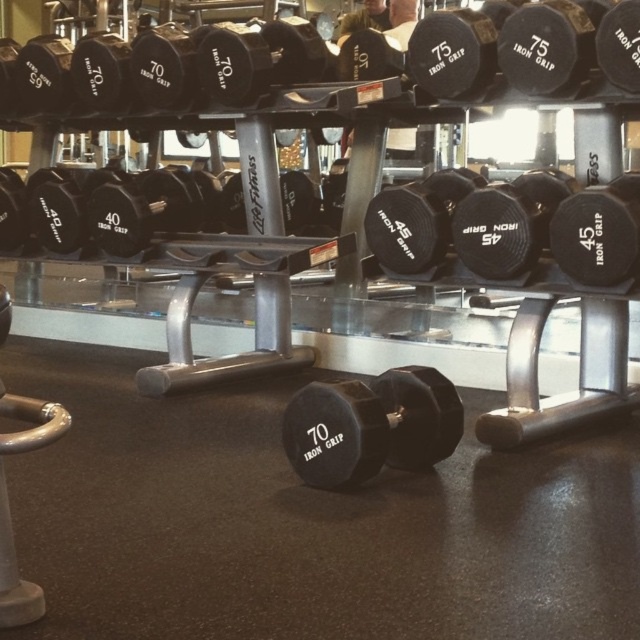
Is black rubber dumbbells at upper center shorter than black rubber dumbbell at center?

No, black rubber dumbbells at upper center is not shorter than black rubber dumbbell at center.

Is point (540, 29) positioned behind point (346, 481)?

Yes, point (540, 29) is behind point (346, 481).

Where is `black rubber dumbbells at upper center`? This screenshot has width=640, height=640. black rubber dumbbells at upper center is located at coordinates (326, 61).